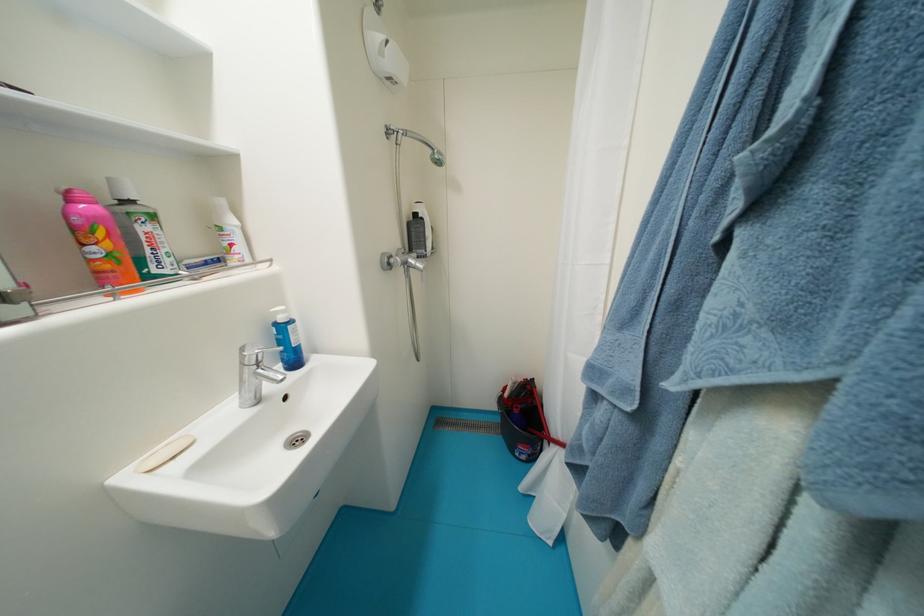
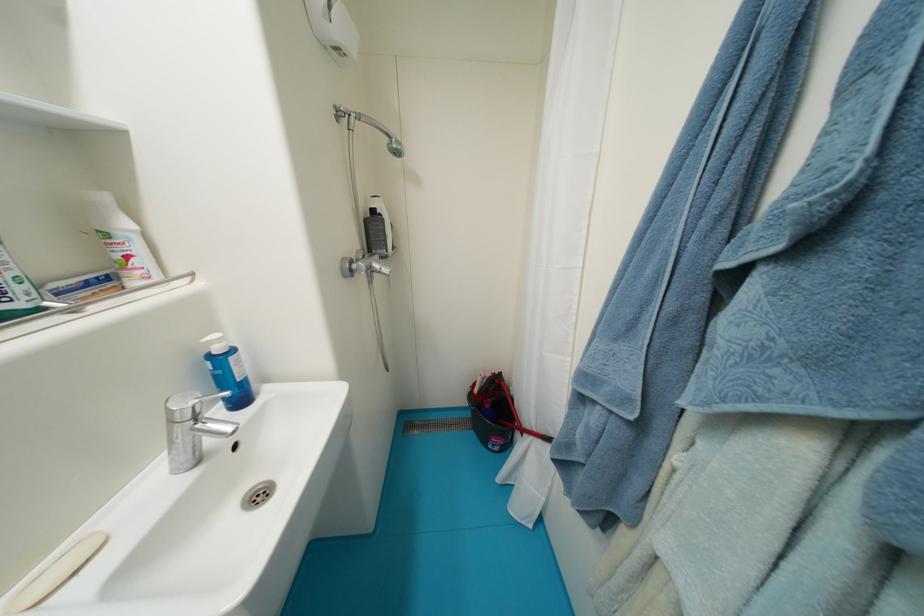
Question: I am providing you with two images of the same scene from different viewpoints. Which of the following objects are not visible in image2?

Choices:
 (A) black dispenser pump
 (B) shower control knob
 (C) black bucket handle
 (D) none of these

Answer: (D)